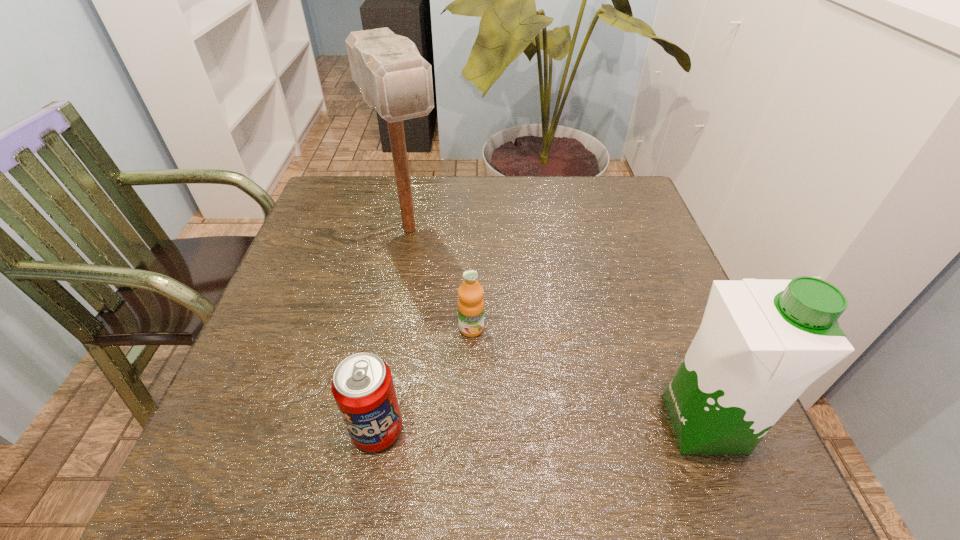
I want to click on unoccupied area between the tallest object and the soya milk, so click(x=556, y=326).

This screenshot has width=960, height=540. Identify the location of unoccupied position between the soda can and the soya milk. (540, 427).

The width and height of the screenshot is (960, 540). Identify the location of vacant space that is in between the tallest object and the soda can. (394, 329).

Find the location of `vacant space that's between the third object from left to right and the soda can`. vacant space that's between the third object from left to right and the soda can is located at coordinates (424, 379).

Identify the location of vacant space that's between the soya milk and the soda can. (540, 427).

Identify which object is located as the third nearest to the rightmost object. Please provide its 2D coordinates. Your answer should be formatted as a tuple, i.e. [(x, y)], where the tuple contains the x and y coordinates of a point satisfying the conditions above.

[(394, 79)]

Point out which object is positioned as the third nearest to the mallet. Please provide its 2D coordinates. Your answer should be formatted as a tuple, i.e. [(x, y)], where the tuple contains the x and y coordinates of a point satisfying the conditions above.

[(761, 343)]